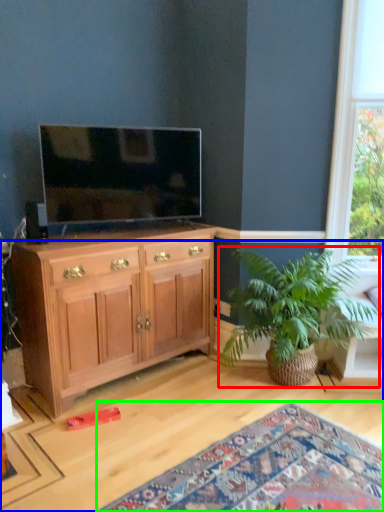
Question: Which object is the farthest from houseplant (highlighted by a red box)? Choose among these: desk (highlighted by a blue box) or plain (highlighted by a green box).

Choices:
 (A) desk
 (B) plain

Answer: (B)